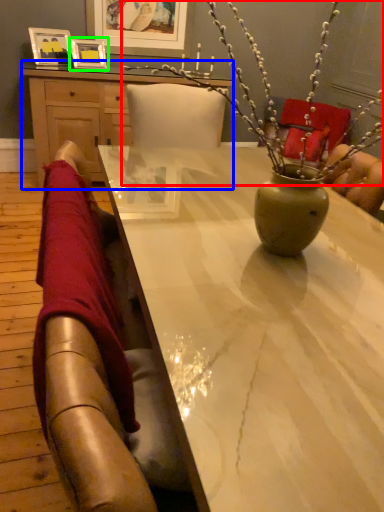
Question: Based on their relative distances, which object is farther from floral arrangement (highlighted by a red box)? Choose from desk (highlighted by a blue box) and picture frame (highlighted by a green box).

Choices:
 (A) desk
 (B) picture frame

Answer: (B)